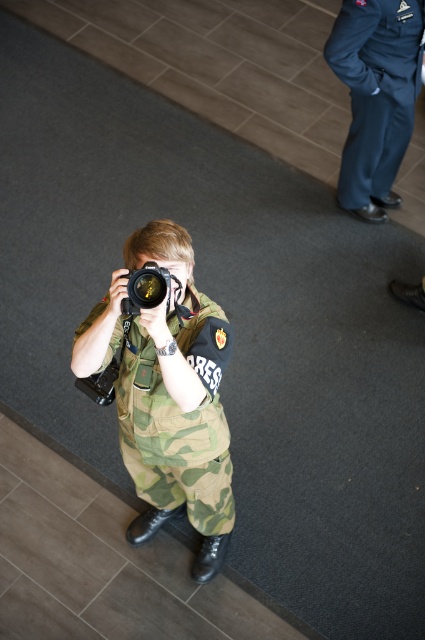
Looking at this image, does camo fabric uniform at center appear on the right side of navy blue fabric pants at upper right?

In fact, camo fabric uniform at center is to the left of navy blue fabric pants at upper right.

Does camo fabric uniform at center have a larger size compared to navy blue fabric pants at upper right?

Yes.

Describe the element at coordinates (172, 440) in the screenshot. I see `camo fabric uniform at center` at that location.

Identify the location of camo fabric uniform at center. This screenshot has width=425, height=640. (x=172, y=440).

Does point (374, 179) come behind point (136, 310)?

Yes, it is behind point (136, 310).

Can you confirm if navy blue fabric pants at upper right is smaller than black plastic camera at center?

No.

Between point (397, 92) and point (127, 289), which one is positioned behind?

The point (397, 92) is more distant.

Locate an element on the screen. navy blue fabric pants at upper right is located at coordinates (376, 96).

The width and height of the screenshot is (425, 640). Describe the element at coordinates (172, 440) in the screenshot. I see `camo fabric uniform at center` at that location.

Which is above, camo fabric uniform at center or black plastic camera at center?

black plastic camera at center is above.

You are a GUI agent. You are given a task and a screenshot of the screen. Output one action in this format:
    pyautogui.click(x=<x>, y=<y>)
    Task: Click on the camo fabric uniform at center
    The height and width of the screenshot is (640, 425).
    Given the screenshot: What is the action you would take?
    pyautogui.click(x=172, y=440)

Find the location of `camo fabric uniform at center`. camo fabric uniform at center is located at coordinates (172, 440).